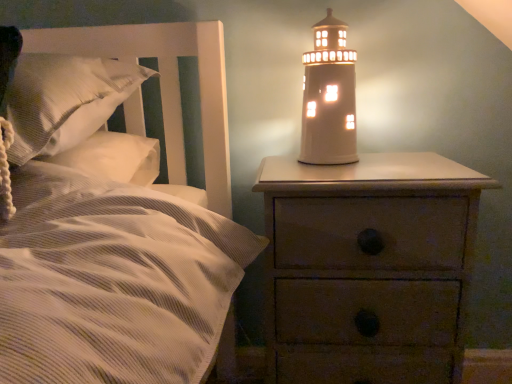
Locate an element on the screen. The width and height of the screenshot is (512, 384). white ceramic lighthouse at upper right is located at coordinates (329, 97).

Describe the element at coordinates (329, 97) in the screenshot. The height and width of the screenshot is (384, 512). I see `white ceramic lighthouse at upper right` at that location.

Locate an element on the screen. The image size is (512, 384). white textured pillow at left is located at coordinates (64, 100).

Considering the relative sizes of wooden nightstand at right and white ceramic lighthouse at upper right in the image provided, is wooden nightstand at right smaller than white ceramic lighthouse at upper right?

Incorrect, wooden nightstand at right is not smaller in size than white ceramic lighthouse at upper right.

Does point (304, 286) come in front of point (304, 54)?

Yes, point (304, 286) is closer to viewer.

Which object is positioned more to the left, wooden nightstand at right or white ceramic lighthouse at upper right?

white ceramic lighthouse at upper right.

From a real-world perspective, is wooden nightstand at right below white ceramic lighthouse at upper right?

Yes, from a real-world perspective, wooden nightstand at right is beneath white ceramic lighthouse at upper right.

From the image's perspective, relative to white ceramic lighthouse at upper right, is white textured pillow at left above or below?

From the image's perspective, white textured pillow at left appears below white ceramic lighthouse at upper right.

The width and height of the screenshot is (512, 384). Find the location of `pillow located underneath the white ceramic lighthouse at upper right (from a real-world perspective)`. pillow located underneath the white ceramic lighthouse at upper right (from a real-world perspective) is located at coordinates (64, 100).

In the scene shown: Does white textured pillow at left lie in front of white ceramic lighthouse at upper right?

Yes, it is in front of white ceramic lighthouse at upper right.

Is white textured pillow at left completely or partially outside of white ceramic lighthouse at upper right?

white textured pillow at left lies outside white ceramic lighthouse at upper right's area.

Are wooden nightstand at right and white textured pillow at left beside each other?

No, wooden nightstand at right is not beside white textured pillow at left.

This screenshot has height=384, width=512. Find the location of `pillow that is in front of the wooden nightstand at right`. pillow that is in front of the wooden nightstand at right is located at coordinates (64, 100).

Consider the image. From the image's perspective, would you say wooden nightstand at right is positioned over white textured pillow at left?

No, from the image's perspective, wooden nightstand at right is not on top of white textured pillow at left.

Is white ceramic lighthouse at upper right oriented towards white textured pillow at left?

No, white ceramic lighthouse at upper right is not oriented towards white textured pillow at left.

Can white textured pillow at left be found inside white ceramic lighthouse at upper right?

No, white textured pillow at left is not inside white ceramic lighthouse at upper right.

Is white ceramic lighthouse at upper right wider or thinner than white textured pillow at left?

In the image, white ceramic lighthouse at upper right appears to be more narrow than white textured pillow at left.

From the image's perspective, which one is positioned lower, white ceramic lighthouse at upper right or white textured pillow at left?

white textured pillow at left.

Does point (346, 154) come closer to viewer compared to point (292, 371)?

No, it is not.

Which object is further away from the camera, white ceramic lighthouse at upper right or wooden nightstand at right?

white ceramic lighthouse at upper right is further away from the camera.

Is white ceramic lighthouse at upper right beside wooden nightstand at right?

white ceramic lighthouse at upper right is not next to wooden nightstand at right, and they're not touching.

From the image's perspective, would you say white ceramic lighthouse at upper right is positioned over wooden nightstand at right?

Yes, from the image's perspective, white ceramic lighthouse at upper right is above wooden nightstand at right.

Would you say white textured pillow at left contains wooden nightstand at right?

No, wooden nightstand at right is not a part of white textured pillow at left.

Is white textured pillow at left closer to the viewer compared to wooden nightstand at right?

Yes, white textured pillow at left is in front of wooden nightstand at right.

Which is more to the left, white textured pillow at left or wooden nightstand at right?

white textured pillow at left.

Is white textured pillow at left shorter than wooden nightstand at right?

Indeed, white textured pillow at left has a lesser height compared to wooden nightstand at right.

There is a wooden nightstand at right. Where is `oil lamp above it (from a real-world perspective)`? The height and width of the screenshot is (384, 512). oil lamp above it (from a real-world perspective) is located at coordinates (329, 97).

At what (x,y) coordinates should I click in order to perform the action: click on pillow in front of the white ceramic lighthouse at upper right. Please return your answer as a coordinate pair (x, y). Image resolution: width=512 pixels, height=384 pixels. Looking at the image, I should click on (64, 100).

Which object lies nearer to the anchor point white ceramic lighthouse at upper right, wooden nightstand at right or white textured pillow at left?

wooden nightstand at right.

From the image, which object appears to be farther from white textured pillow at left, wooden nightstand at right or white ceramic lighthouse at upper right?

wooden nightstand at right is further to white textured pillow at left.

When comparing their distances from wooden nightstand at right, does white ceramic lighthouse at upper right or white textured pillow at left seem further?

white textured pillow at left is positioned further to the anchor wooden nightstand at right.

In the scene shown: When comparing their distances from white ceramic lighthouse at upper right, does white textured pillow at left or wooden nightstand at right seem closer?

The object closer to white ceramic lighthouse at upper right is wooden nightstand at right.

Looking at the image, which one is located further to wooden nightstand at right, white textured pillow at left or white ceramic lighthouse at upper right?

white textured pillow at left.

In the scene shown: From the image, which object appears to be farther from white textured pillow at left, white ceramic lighthouse at upper right or wooden nightstand at right?

wooden nightstand at right.

The width and height of the screenshot is (512, 384). Find the location of `oil lamp between white textured pillow at left and wooden nightstand at right in the horizontal direction`. oil lamp between white textured pillow at left and wooden nightstand at right in the horizontal direction is located at coordinates click(x=329, y=97).